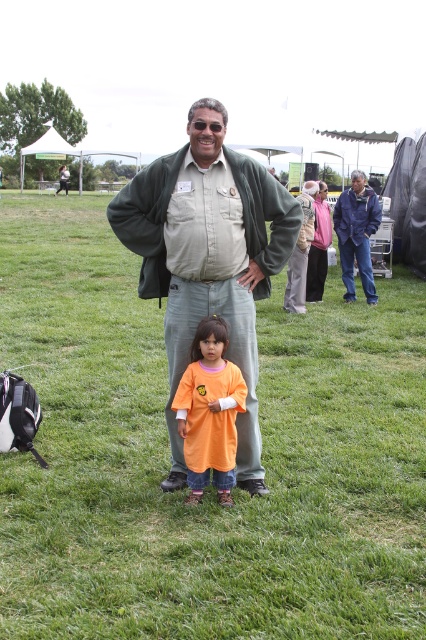
Which is behind, point (181, 480) or point (198, 403)?

The point (181, 480) is more distant.

Can you confirm if matte khaki shirt at center is positioned below orange cotton shirt at center?

Actually, matte khaki shirt at center is above orange cotton shirt at center.

Is point (270, 275) in front of point (212, 412)?

No, it is not.

You are a GUI agent. You are given a task and a screenshot of the screen. Output one action in this format:
    pyautogui.click(x=<x>, y=<y>)
    Task: Click on the matte khaki shirt at center
    Image resolution: width=426 pixels, height=640 pixels.
    Given the screenshot: What is the action you would take?
    pyautogui.click(x=207, y=259)

The image size is (426, 640). What do you see at coordinates (207, 259) in the screenshot? I see `matte khaki shirt at center` at bounding box center [207, 259].

Is matte khaki shirt at center smaller than blue denim jacket at center?

No.

Locate an element on the screen. The height and width of the screenshot is (640, 426). matte khaki shirt at center is located at coordinates pos(207,259).

Can you confirm if green grass at center is positioned below orange cotton shirt at center?

Actually, green grass at center is above orange cotton shirt at center.

Does green grass at center have a smaller size compared to orange cotton shirt at center?

Incorrect, green grass at center is not smaller in size than orange cotton shirt at center.

Between point (290, 392) and point (198, 360), which one is positioned in front?

Positioned in front is point (198, 360).

Image resolution: width=426 pixels, height=640 pixels. Find the location of `green grass at center`. green grass at center is located at coordinates (210, 486).